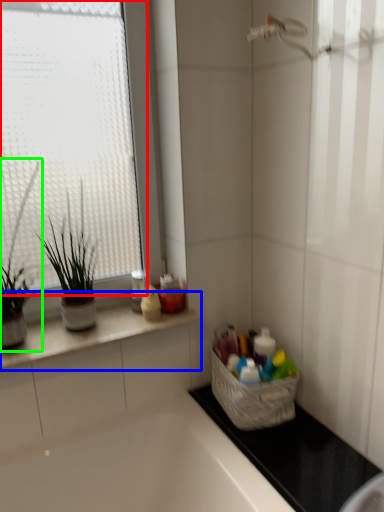
Question: Based on their relative distances, which object is farther from window (highlighted by a red box)? Choose from countertop (highlighted by a blue box) and houseplant (highlighted by a green box).

Choices:
 (A) countertop
 (B) houseplant

Answer: (A)